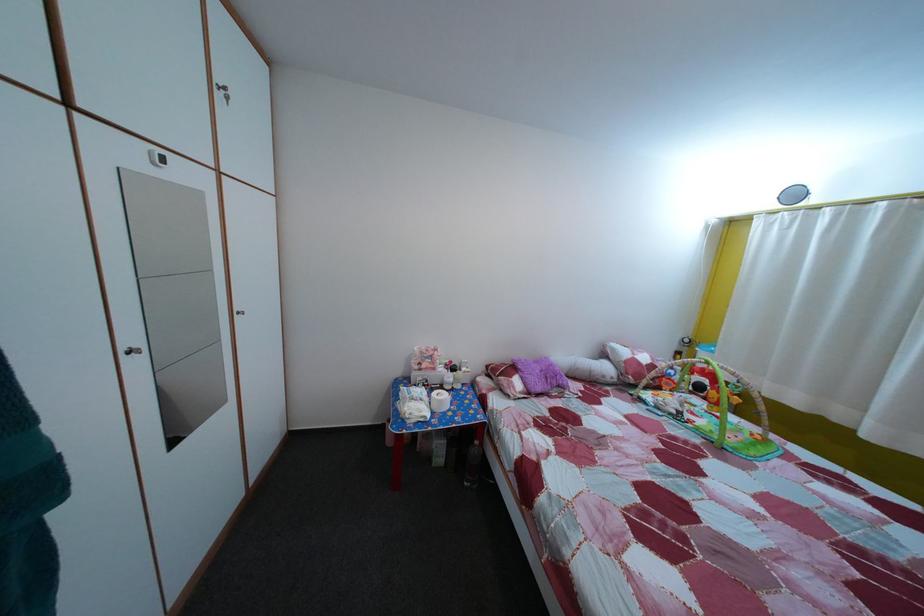
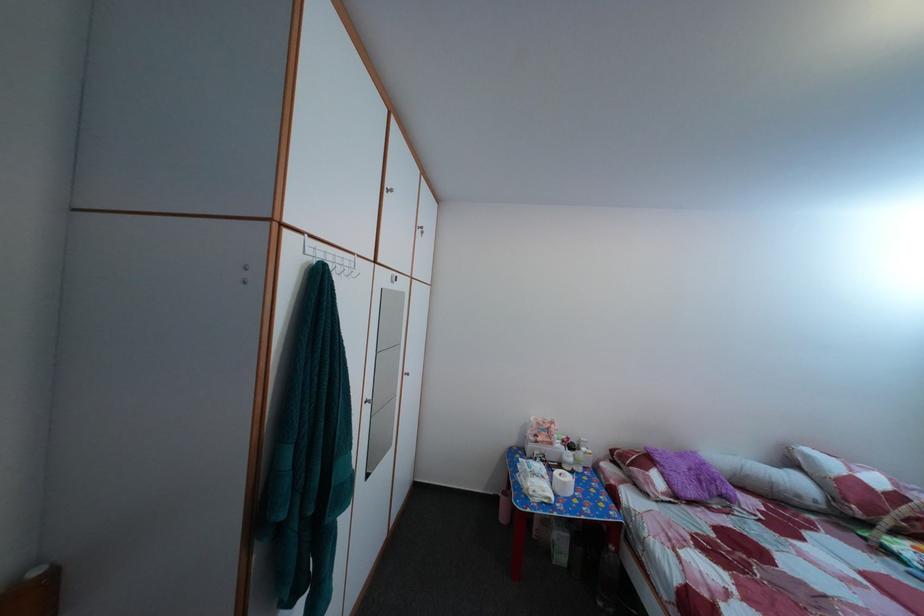
Find the pixel in the second image that matches the point at 438,392 in the first image.

(555, 469)